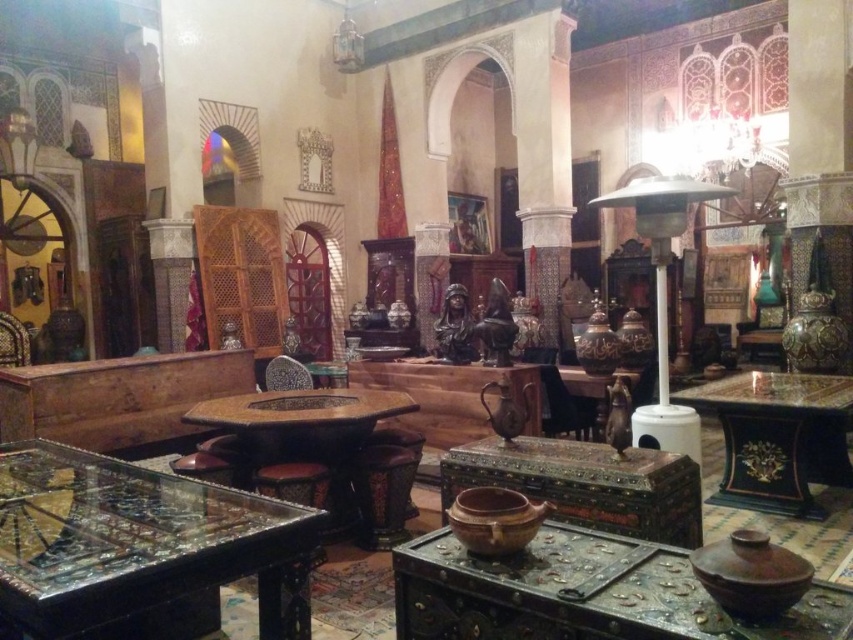
You are arranging flowers in the brown earthenware pot at center and want to place it so that it is to the right of the wooden chest at center. Is the current arrangement correct?

The brown earthenware pot at center is currently positioned on the left side of the wooden chest at center, so it is not placed to the right as desired. You need to move it to the right side of the wooden chest at center.

You are a delivery person who needs to place a new item between the brown earthenware pot at center and the wooden chest at center. The item requires 10 feet of space. Can you fit it there?

The brown earthenware pot at center and wooden chest at center are 12.07 feet apart, so yes, the item requiring 10 feet of space can fit between them since the available space is larger than the required space.